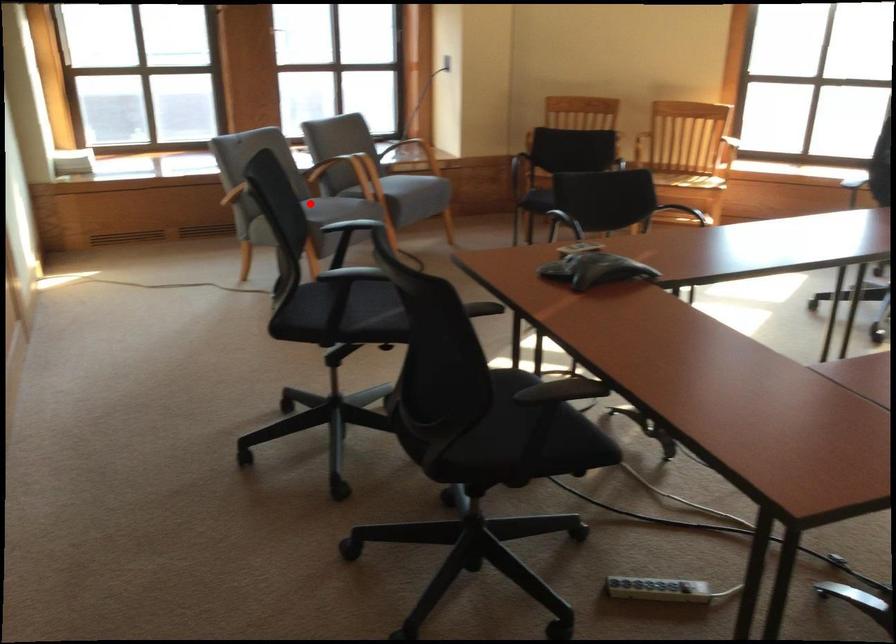
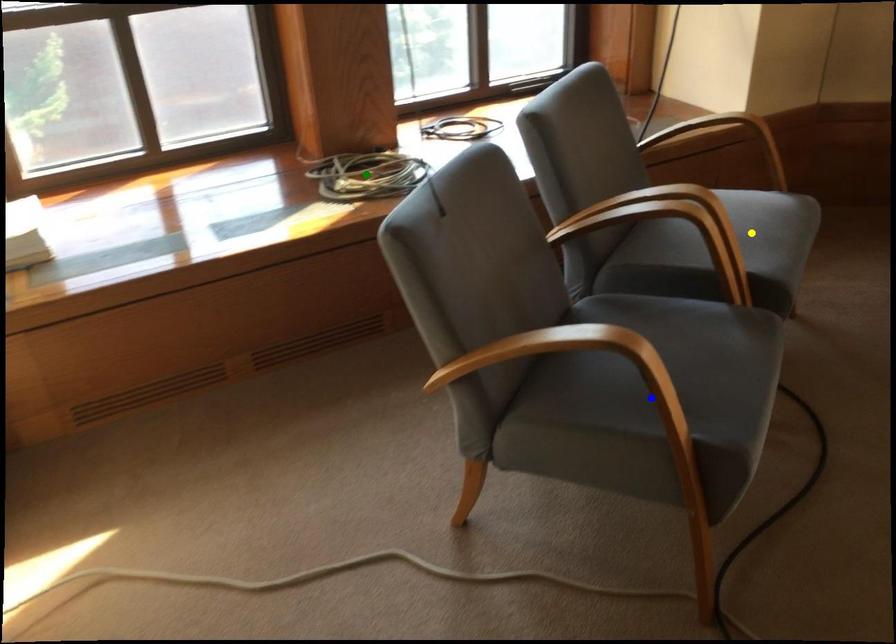
Question: I am providing you with two images of the same scene from different viewpoints. A red point is marked on the first image. You are given multiple points on the second image. Which spot in image 2 lines up with the point in image 1?

Choices:
 (A) blue point
 (B) yellow point
 (C) green point

Answer: (A)